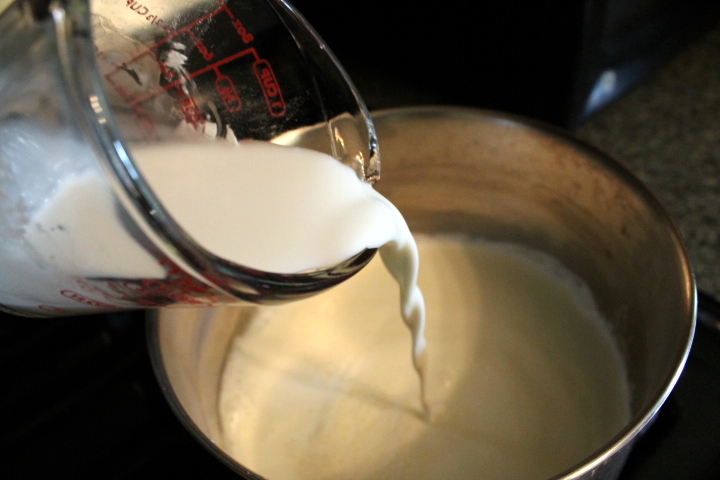
What are the coordinates of `mixing bowl` in the screenshot? It's located at (582, 234).